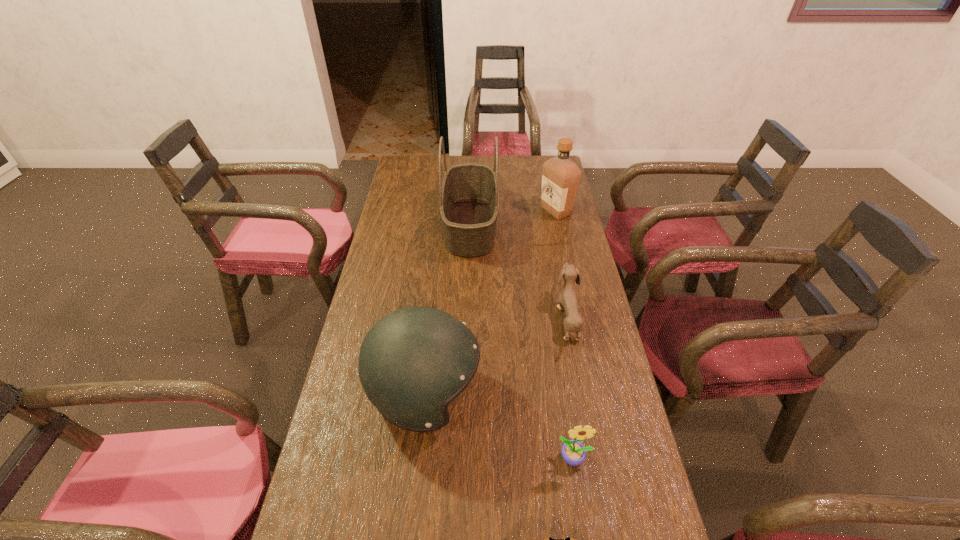
In the image, there is a desktop. In order to click on vacant region at the far left corner in this screenshot , I will do `click(403, 159)`.

This screenshot has height=540, width=960. What are the coordinates of `free space between the sunflower and the football helmet` in the screenshot? It's located at (499, 427).

You are a GUI agent. You are given a task and a screenshot of the screen. Output one action in this format:
    pyautogui.click(x=<x>, y=<y>)
    Task: Click on the vacant area that lies between the sunflower and the basket
    This screenshot has width=960, height=540.
    Given the screenshot: What is the action you would take?
    pyautogui.click(x=522, y=342)

Locate an element on the screen. free space between the liquor and the basket is located at coordinates (514, 218).

Locate an element on the screen. This screenshot has width=960, height=540. unoccupied position between the liquor and the basket is located at coordinates (514, 218).

At what (x,y) coordinates should I click in order to perform the action: click on vacant area that lies between the fourth nearest object and the third nearest object. Please return your answer as a coordinate pair (x, y). Looking at the image, I should click on (496, 357).

The width and height of the screenshot is (960, 540). Find the location of `free space between the puppy and the football helmet`. free space between the puppy and the football helmet is located at coordinates (496, 357).

Find the location of a particular element. The image size is (960, 540). free area in between the basket and the liquor is located at coordinates (514, 218).

This screenshot has width=960, height=540. I want to click on the third closest object to the nearest object, so click(x=568, y=299).

Select which object appears as the fifth closest to the fifth farthest object. Please provide its 2D coordinates. Your answer should be formatted as a tuple, i.e. [(x, y)], where the tuple contains the x and y coordinates of a point satisfying the conditions above.

[(560, 175)]